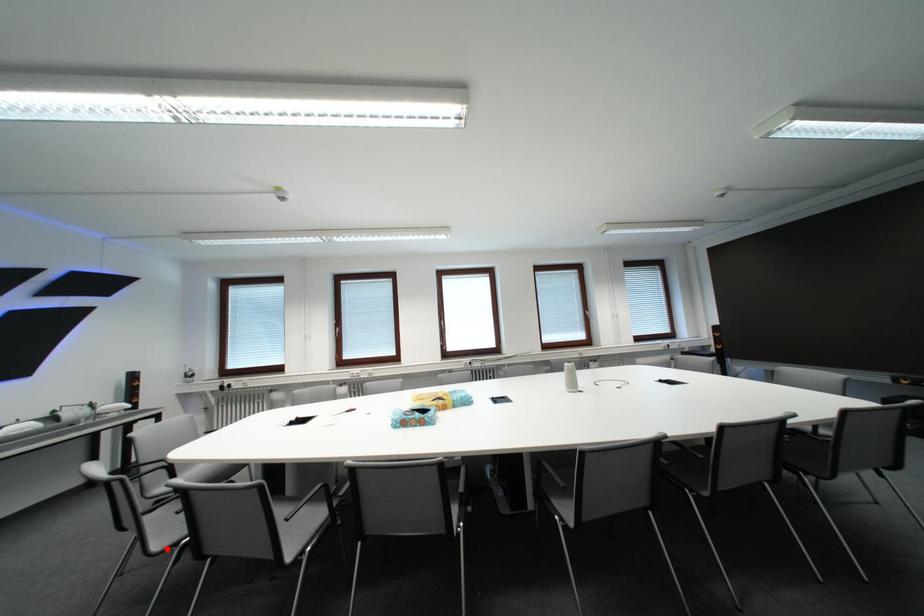
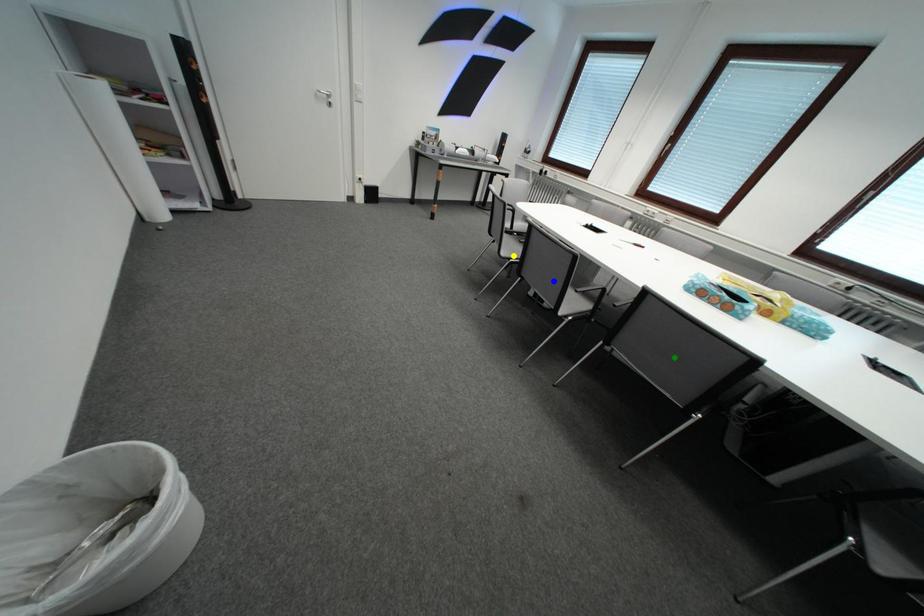
Question: I am providing you with two images of the same scene from different viewpoints. A red point is marked on the first image. You are given multiple points on the second image. Which mark in image 2 goes with the point in image 1?

Choices:
 (A) yellow point
 (B) green point
 (C) blue point

Answer: (A)